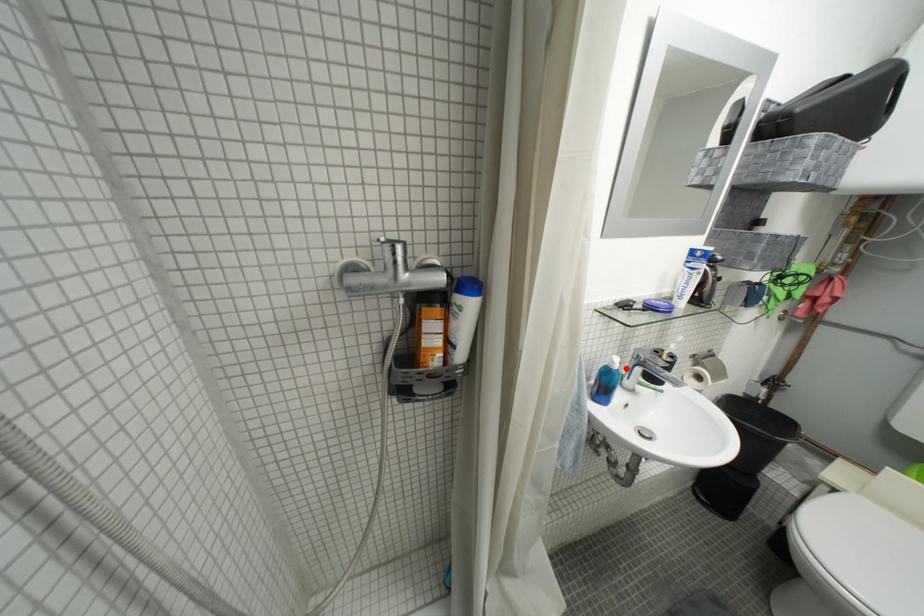
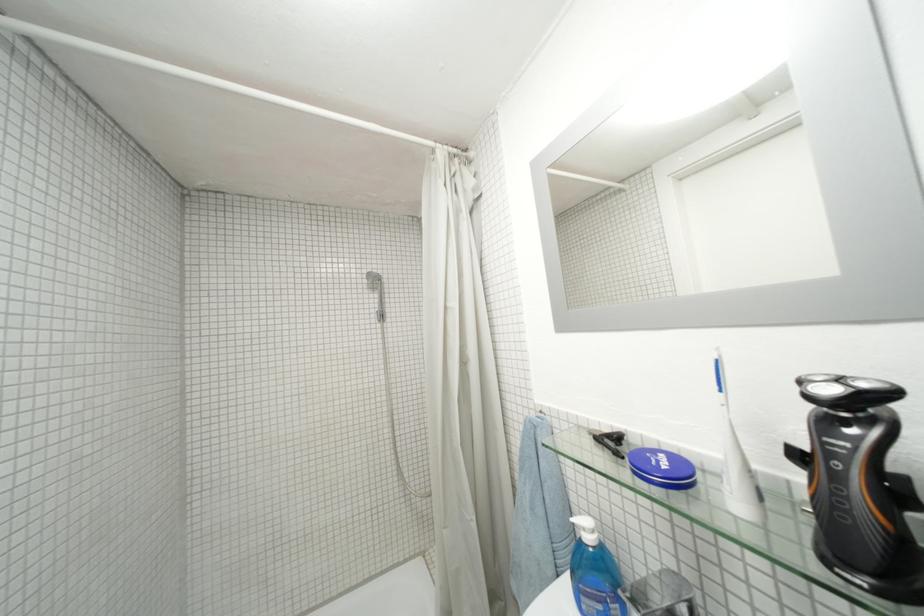
Find the pixel in the second image that matches the highlighted location in the first image.

(598, 541)